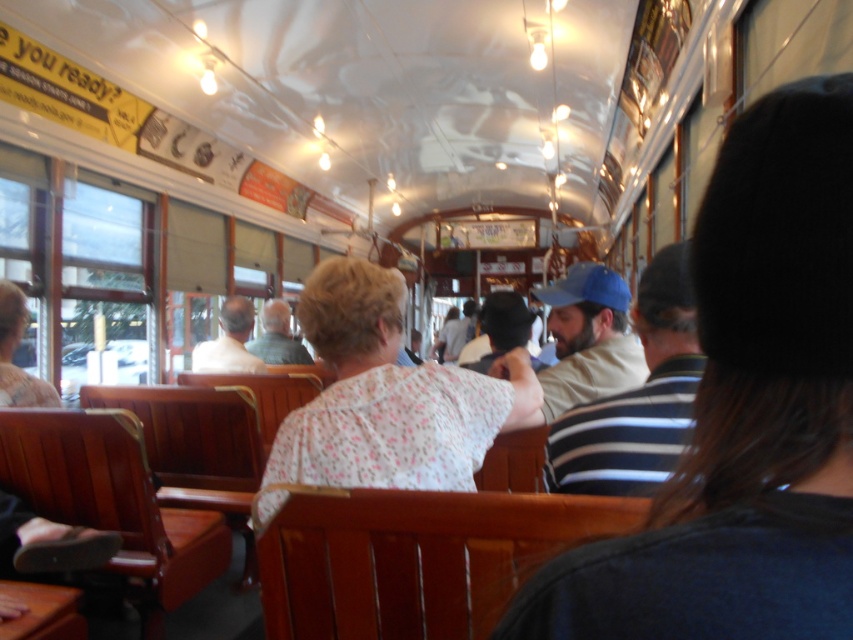
Does striped cotton shirt at center have a lesser width compared to light brown leather jacket at center?

Correct, striped cotton shirt at center's width is less than light brown leather jacket at center's.

Is point (654, 582) farther from viewer compared to point (219, 355)?

That is False.

Locate an element on the screen. The width and height of the screenshot is (853, 640). striped cotton shirt at center is located at coordinates (746, 410).

Where is `floral fabric blouse at center`? This screenshot has height=640, width=853. floral fabric blouse at center is located at coordinates (386, 397).

From the picture: Is floral fabric blouse at center to the left of blue fabric cap at center from the viewer's perspective?

Yes, floral fabric blouse at center is to the left of blue fabric cap at center.

Where is `floral fabric blouse at center`? The width and height of the screenshot is (853, 640). floral fabric blouse at center is located at coordinates (386, 397).

Image resolution: width=853 pixels, height=640 pixels. Find the location of `floral fabric blouse at center`. floral fabric blouse at center is located at coordinates (386, 397).

Is blue fabric cap at center to the left of light brown leather jacket at center from the viewer's perspective?

No, blue fabric cap at center is not to the left of light brown leather jacket at center.

Can you confirm if blue fabric cap at center is positioned to the right of light brown leather jacket at center?

Yes, blue fabric cap at center is to the right of light brown leather jacket at center.

This screenshot has width=853, height=640. Describe the element at coordinates (637, 397) in the screenshot. I see `blue fabric cap at center` at that location.

Locate an element on the screen. Image resolution: width=853 pixels, height=640 pixels. blue fabric cap at center is located at coordinates (637, 397).